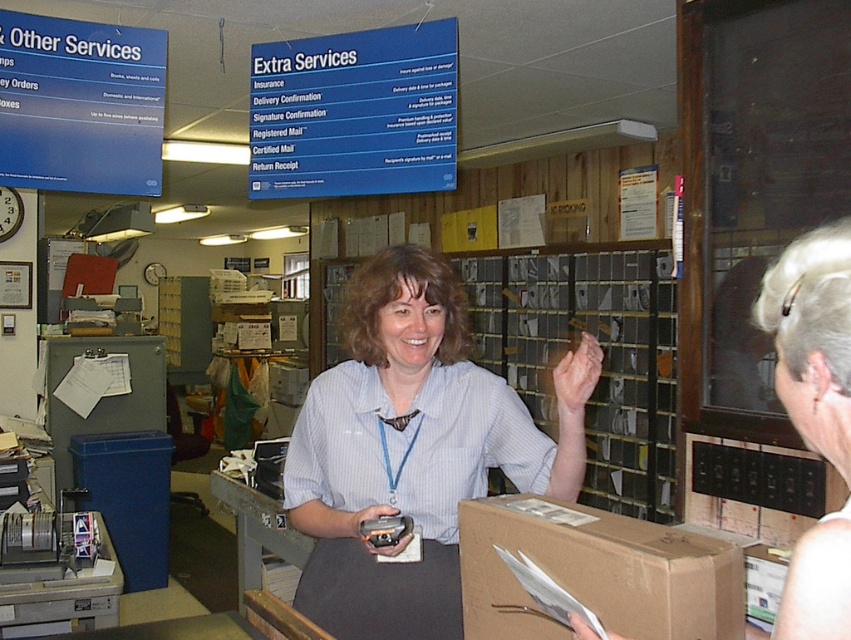
You are a customer standing in front of the counter in the post office. You need to hand over a package to the staff member. Which object is closer to you between the white striped shirt at center and the brown cardboard box at lower center?

The white striped shirt at center is closer to you because it is further to the viewer than the brown cardboard box at lower center.

You are a customer in the post office and want to hand over a package. You see the white striped shirt at center and the brown cardboard box at lower center. Which object is closer to the left side of the counter?

The white striped shirt at center is to the left of the brown cardboard box at lower center, so it is closer to the left side of the counter.

You are a customer at the post office and want to place an item on the counter. The counter has the white striped shirt at center and the brown cardboard box at lower center. Which object is higher up on the counter?

The white striped shirt at center is above the brown cardboard box at lower center, so the white striped shirt at center is higher up on the counter.